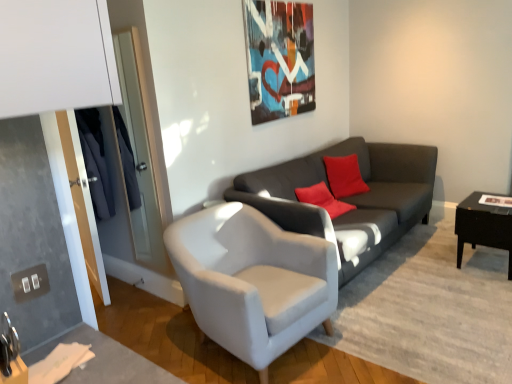
Image resolution: width=512 pixels, height=384 pixels. Describe the element at coordinates (483, 226) in the screenshot. I see `black glossy table at right` at that location.

Where is `white fabric armchair at center`? white fabric armchair at center is located at coordinates 252,280.

Locate an element on the screen. black glossy table at right is located at coordinates (483, 226).

Between black glossy table at right and white fabric armchair at center, which one has less height?

black glossy table at right.

Considering the positions of objects black glossy table at right and white fabric armchair at center in the image provided, who is in front, black glossy table at right or white fabric armchair at center?

white fabric armchair at center is in front.

The image size is (512, 384). I want to click on chair located below the black glossy table at right (from the image's perspective), so click(252, 280).

Is point (498, 237) farther from viewer compared to point (250, 216)?

Yes.

Considering the relative positions of dark gray fabric couch at center and black glossy table at right in the image provided, is dark gray fabric couch at center to the left of black glossy table at right from the viewer's perspective?

Indeed, dark gray fabric couch at center is positioned on the left side of black glossy table at right.

Is the position of dark gray fabric couch at center more distant than that of black glossy table at right?

No, it is in front of black glossy table at right.

From the picture: From the image's perspective, is dark gray fabric couch at center under black glossy table at right?

Incorrect, from the image's perspective, dark gray fabric couch at center is higher than black glossy table at right.

Looking at this image, which point is more forward, (382, 204) or (501, 232)?

The point (501, 232) is more forward.

Would you say black glossy table at right is a long distance from dark gray fabric couch at center?

black glossy table at right is near dark gray fabric couch at center, not far away.

From a real-world perspective, does black glossy table at right sit lower than dark gray fabric couch at center?

Yes.

Considering the sizes of objects black glossy table at right and dark gray fabric couch at center in the image provided, who is wider, black glossy table at right or dark gray fabric couch at center?

Wider between the two is dark gray fabric couch at center.

In the scene shown: Considering the relative sizes of black glossy table at right and dark gray fabric couch at center in the image provided, is black glossy table at right smaller than dark gray fabric couch at center?

Yes.

Locate an element on the screen. The height and width of the screenshot is (384, 512). table below the white fabric armchair at center (from a real-world perspective) is located at coordinates (483, 226).

From a real-world perspective, is white fabric armchair at center positioned over black glossy table at right based on gravity?

Yes.

Is white fabric armchair at center behind black glossy table at right?

No, it is not.

From a real-world perspective, is white fabric armchair at center positioned over dark gray fabric couch at center based on gravity?

No, from a real-world perspective, white fabric armchair at center is not above dark gray fabric couch at center.

From the image's perspective, is white fabric armchair at center under dark gray fabric couch at center?

Yes, from the image's perspective, white fabric armchair at center is beneath dark gray fabric couch at center.

Is white fabric armchair at center taller or shorter than dark gray fabric couch at center?

Considering their sizes, white fabric armchair at center has less height than dark gray fabric couch at center.

Is dark gray fabric couch at center not inside white fabric armchair at center?

dark gray fabric couch at center is positioned outside white fabric armchair at center.

Does dark gray fabric couch at center touch white fabric armchair at center?

There is a gap between dark gray fabric couch at center and white fabric armchair at center.

From a real-world perspective, is dark gray fabric couch at center on white fabric armchair at center?

Yes.

From the image's perspective, between dark gray fabric couch at center and white fabric armchair at center, which one is located above?

dark gray fabric couch at center.

Image resolution: width=512 pixels, height=384 pixels. Identify the location of chair on the left side of black glossy table at right. (252, 280).

Locate an element on the screen. The width and height of the screenshot is (512, 384). table below the dark gray fabric couch at center (from the image's perspective) is located at coordinates (483, 226).

Which object lies nearer to the anchor point white fabric armchair at center, black glossy table at right or dark gray fabric couch at center?

Based on the image, dark gray fabric couch at center appears to be nearer to white fabric armchair at center.

Based on their spatial positions, is white fabric armchair at center or black glossy table at right closer to dark gray fabric couch at center?

white fabric armchair at center lies closer to dark gray fabric couch at center than the other object.

In the scene shown: When comparing their distances from black glossy table at right, does dark gray fabric couch at center or white fabric armchair at center seem closer?

dark gray fabric couch at center lies closer to black glossy table at right than the other object.

From the image, which object appears to be farther from dark gray fabric couch at center, black glossy table at right or white fabric armchair at center?

Among the two, black glossy table at right is located further to dark gray fabric couch at center.

Which object lies further to the anchor point white fabric armchair at center, dark gray fabric couch at center or black glossy table at right?

The object further to white fabric armchair at center is black glossy table at right.

From the image, which object appears to be farther from black glossy table at right, white fabric armchair at center or dark gray fabric couch at center?

The object further to black glossy table at right is white fabric armchair at center.

Where is `studio couch between white fabric armchair at center and black glossy table at right from left to right`? The height and width of the screenshot is (384, 512). studio couch between white fabric armchair at center and black glossy table at right from left to right is located at coordinates (348, 198).